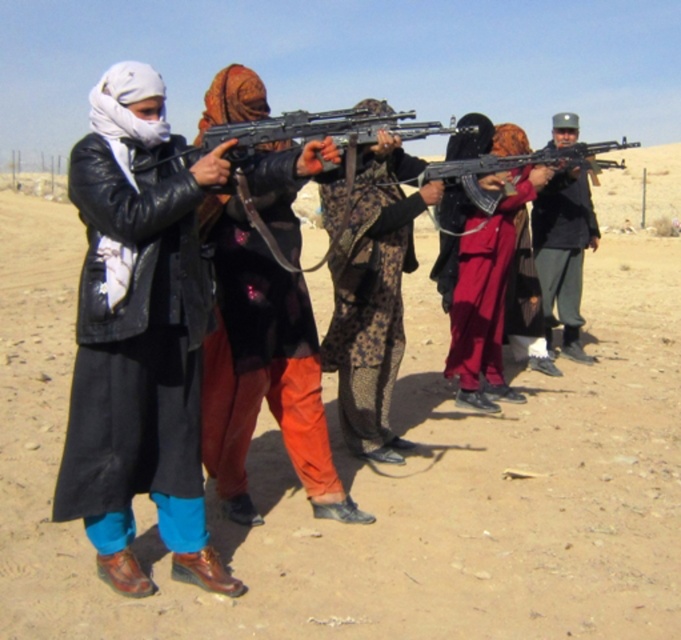
Can you confirm if leather jacket at left is positioned below orange fabric pants at center?

Correct, leather jacket at left is located below orange fabric pants at center.

Between point (195, 449) and point (249, 264), which one is positioned in front?

Point (195, 449)

Who is more forward, (123, 355) or (217, 276)?

Point (123, 355)

What are the coordinates of `leather jacket at left` in the screenshot? It's located at (138, 340).

Which of these two, orange fabric pants at center or patterned fabric dress at center, stands shorter?

orange fabric pants at center

Is orange fabric pants at center taller than patterned fabric dress at center?

No.

Which is behind, point (204, 348) or point (373, 257)?

Positioned behind is point (373, 257).

This screenshot has width=681, height=640. In order to click on orange fabric pants at center in this screenshot , I will do `click(259, 362)`.

Is the position of patterned fabric dress at center less distant than that of dark gray uniform at center?

Yes, it is in front of dark gray uniform at center.

Is point (385, 364) less distant than point (560, 221)?

Yes, point (385, 364) is closer to viewer.

Image resolution: width=681 pixels, height=640 pixels. I want to click on patterned fabric dress at center, so coord(373,296).